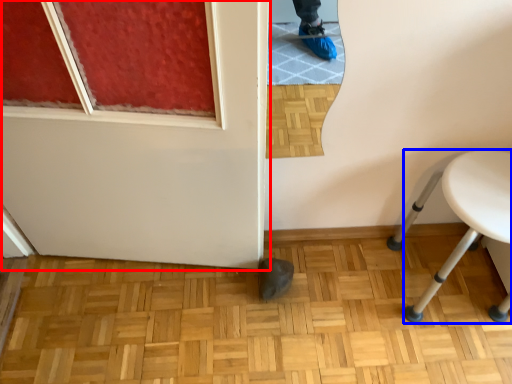
Question: Which object appears farthest to the camera in this image, door (highlighted by a red box) or furniture (highlighted by a blue box)?

Choices:
 (A) door
 (B) furniture

Answer: (B)